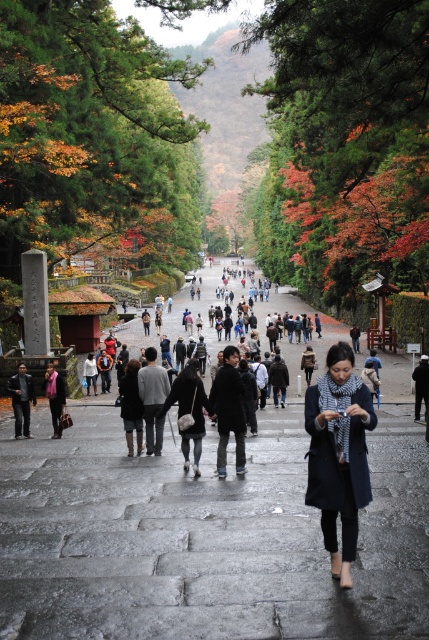
Question: Does stone paved pathway at center have a smaller size compared to gray wool sweater at center?

Choices:
 (A) yes
 (B) no

Answer: (B)

Question: Among these objects, which one is farthest from the camera?

Choices:
 (A) green textured stone at center
 (B) dark blue jacket at center
 (C) brown leather jacket at center
 (D) gray wool sweater at center

Answer: (B)

Question: Which point is closer to the camera?

Choices:
 (A) dark blue jacket at center
 (B) dark blue wool coat at center
 (C) dark gray wool coat at center

Answer: (B)

Question: Among these objects, which one is farthest from the camera?

Choices:
 (A) blue woolen scarf at center
 (B) black leather jacket at center
 (C) stone paved pathway at center

Answer: (B)

Question: Is green textured stone at center behind dark gray wool coat at center?

Choices:
 (A) no
 (B) yes

Answer: (B)

Question: Is green textured stone at center thinner than gray wool sweater at center?

Choices:
 (A) no
 (B) yes

Answer: (A)